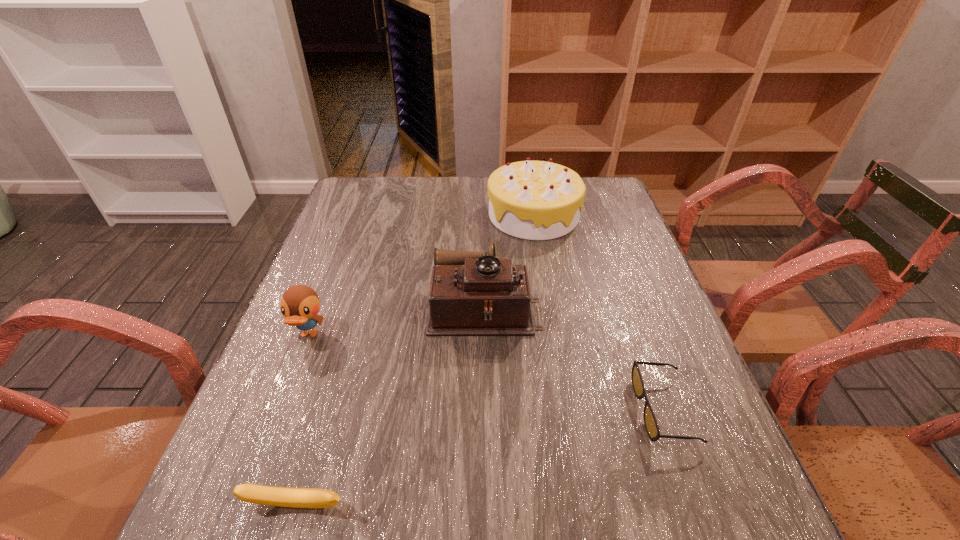
Locate an element on the screen. The width and height of the screenshot is (960, 540). free location that satisfies the following two spatial constraints: 1. on the horn of the phonograph_record; 2. at the stem of the banana is located at coordinates (487, 505).